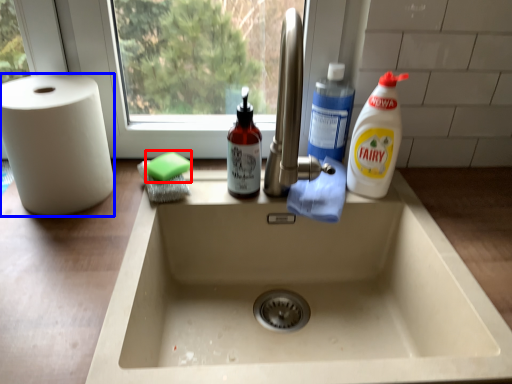
Question: Which point is closer to the camera, soap (highlighted by a red box) or paper towel (highlighted by a blue box)?

Choices:
 (A) soap
 (B) paper towel

Answer: (B)